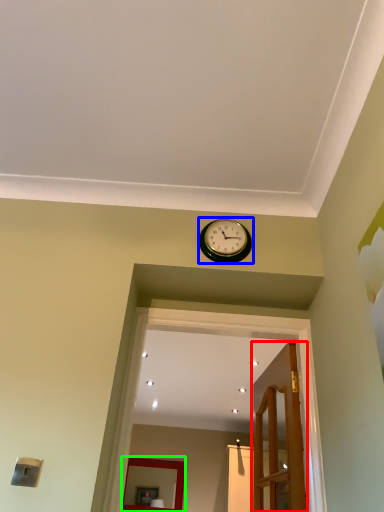
Question: Which object is the farthest from door (highlighted by a red box)? Choose among these: wall clock (highlighted by a blue box) or mirror (highlighted by a green box).

Choices:
 (A) wall clock
 (B) mirror

Answer: (B)